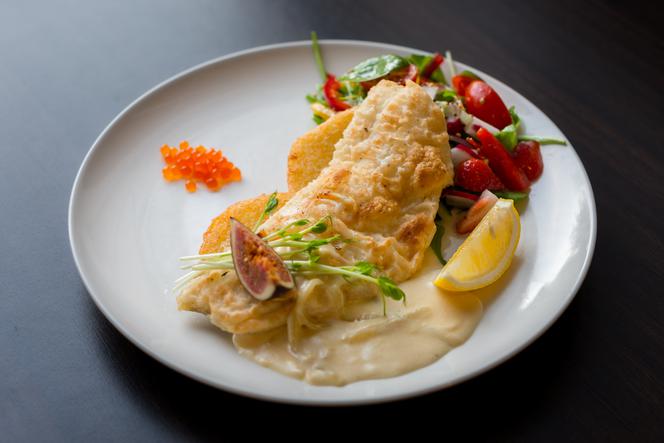
At what (x,y) coordinates should I click in order to perform the action: click on white plate. Please return your answer as a coordinate pair (x, y). This screenshot has height=443, width=664. Looking at the image, I should click on (92, 192).